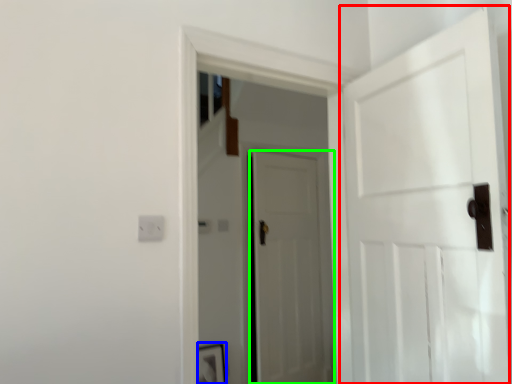
Question: Considering the real-world distances, which object is farthest from door (highlighted by a red box)? picture frame (highlighted by a blue box) or door (highlighted by a green box)?

Choices:
 (A) picture frame
 (B) door

Answer: (A)